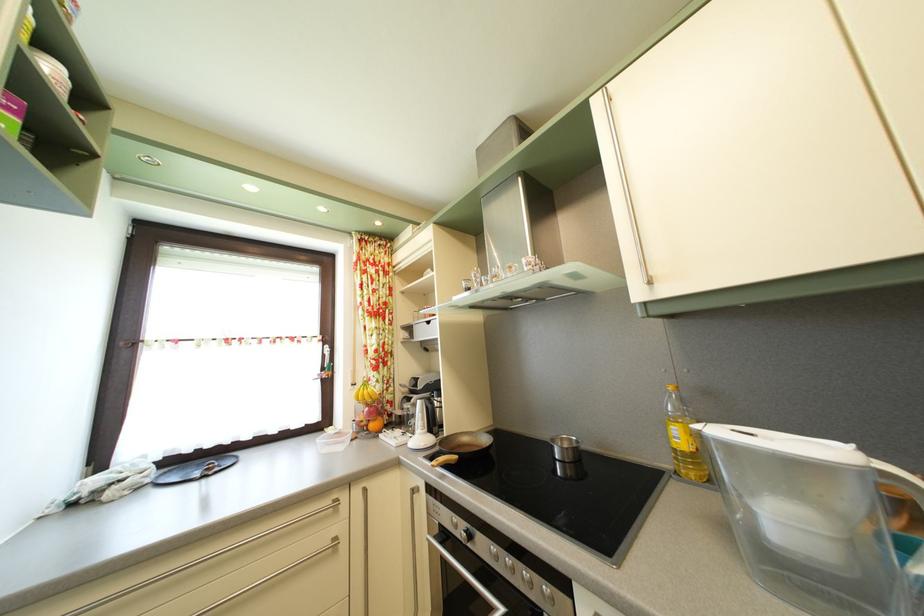
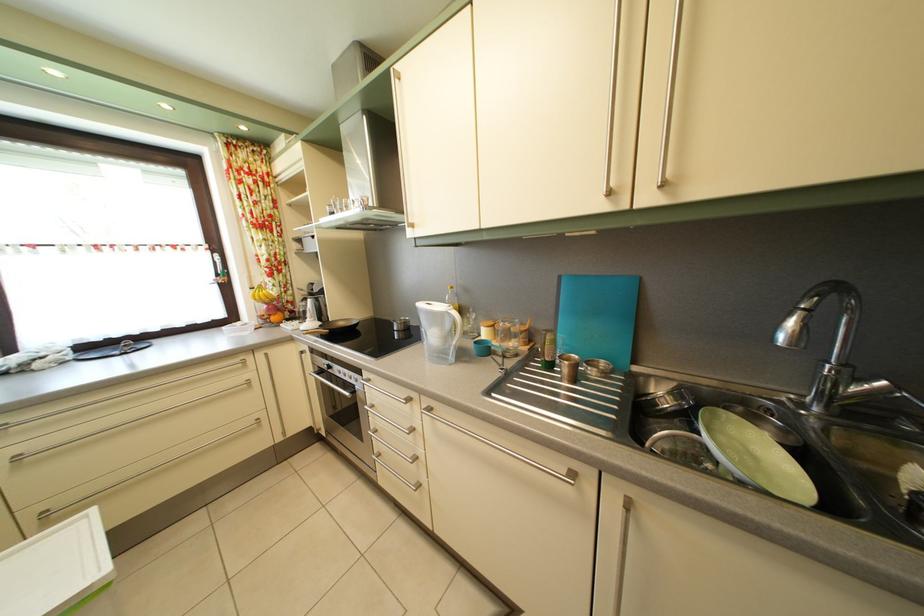
The point at (205, 458) is marked in the first image. Where is the corresponding point in the second image?

(116, 347)